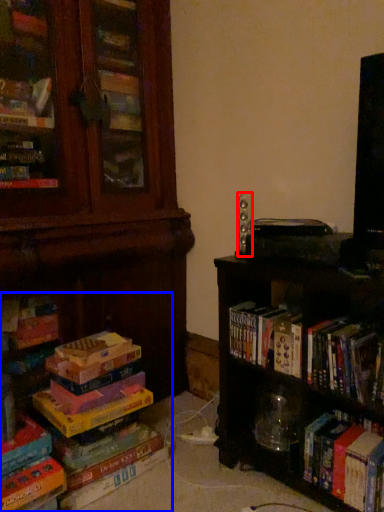
Question: Which object is further to the camera taking this photo, speaker (highlighted by a red box) or book (highlighted by a blue box)?

Choices:
 (A) speaker
 (B) book

Answer: (A)